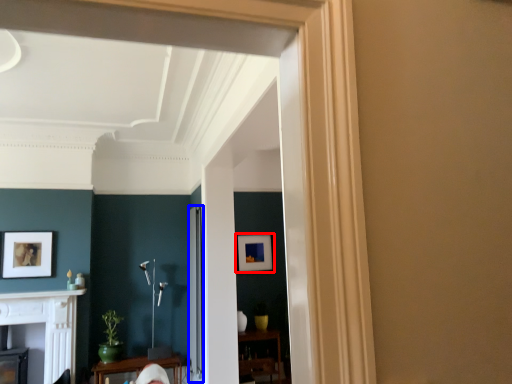
Question: Which object appears closest to the camera in this image, picture frame (highlighted by a red box) or glass door (highlighted by a blue box)?

Choices:
 (A) picture frame
 (B) glass door

Answer: (B)